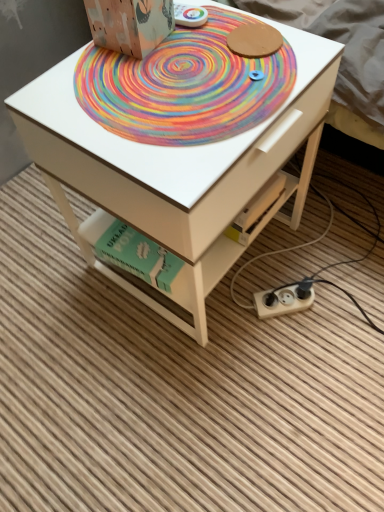
This screenshot has width=384, height=512. In order to click on vacant area situated below rainbow painted mat at center (from a real-world perspective) in this screenshot , I will do pos(183,81).